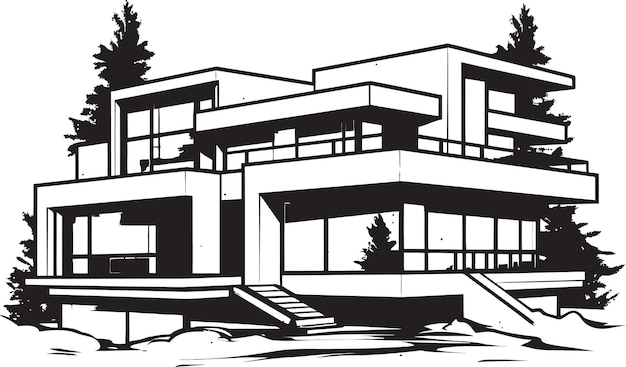
This screenshot has width=626, height=367. Identify the location of black and white outline of modern home. (332, 172).